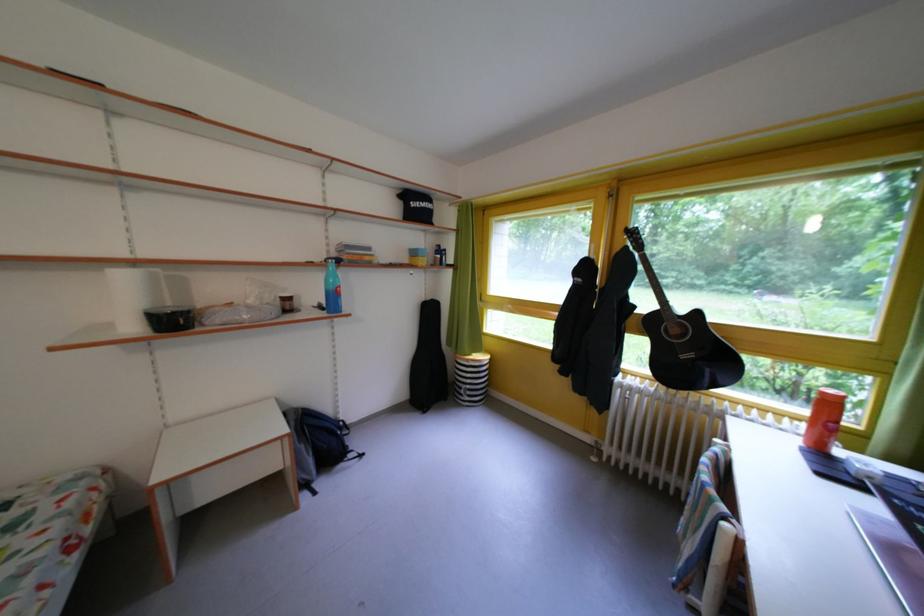
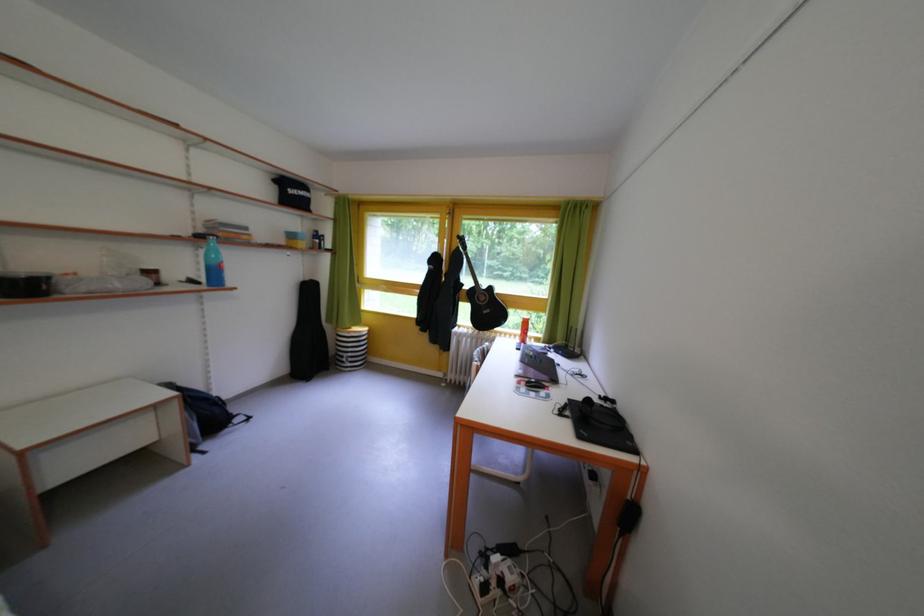
Question: The images are taken continuously from a first-person perspective. In which direction is your viewpoint rotating?

Choices:
 (A) Left
 (B) Right
 (C) Up
 (D) Down

Answer: (B)